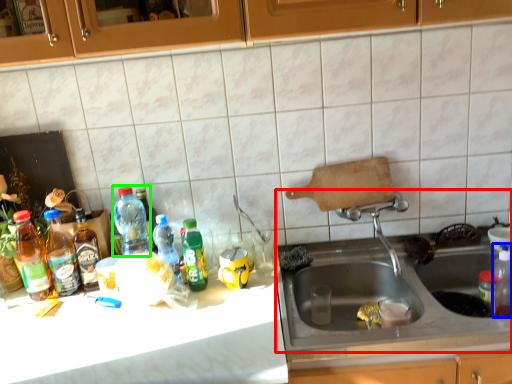
Question: Estimate the real-world distances between objects in this image. Which object is farther from sink (highlighted by a red box), bottle (highlighted by a blue box) or bottle (highlighted by a green box)?

Choices:
 (A) bottle
 (B) bottle

Answer: (B)